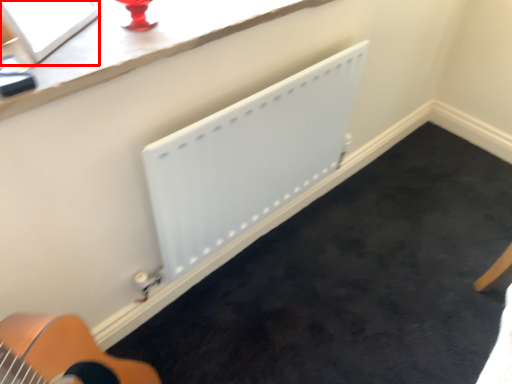
Question: Where is window screen (annotated by the red box) located in relation to radiator in the image?

Choices:
 (A) left
 (B) right

Answer: (A)